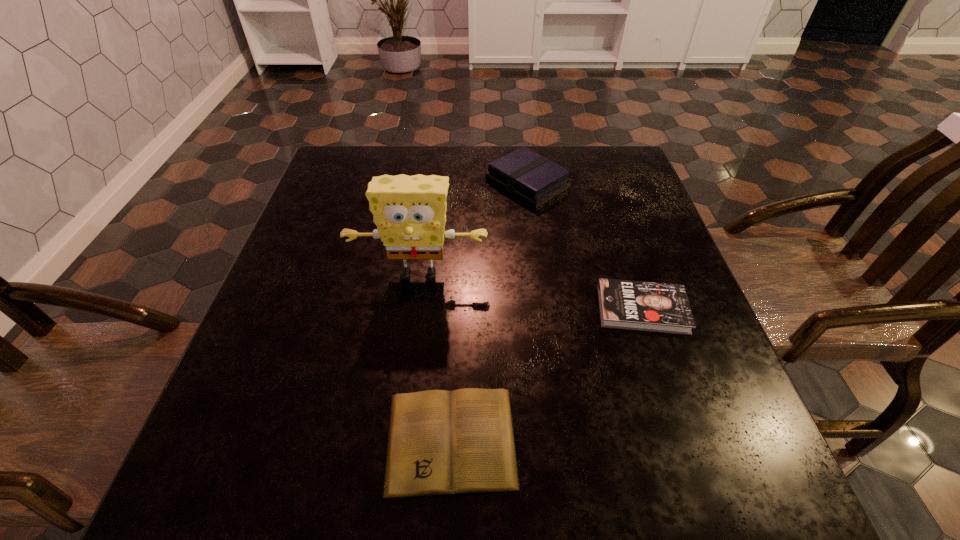
Where is `vacant area at the near right corner of the desktop`? The width and height of the screenshot is (960, 540). vacant area at the near right corner of the desktop is located at coordinates (787, 512).

Identify the location of empty location between the second tallest object and the nearest object. The width and height of the screenshot is (960, 540). (490, 312).

Where is `vacant region between the second shortest book and the tallest book`? The image size is (960, 540). vacant region between the second shortest book and the tallest book is located at coordinates (585, 246).

Identify the location of vacant point located between the nearest book and the tallest object. The width and height of the screenshot is (960, 540). (435, 357).

Locate an element on the screen. vacant space that's between the second shortest object and the tallest object is located at coordinates (531, 292).

You are a GUI agent. You are given a task and a screenshot of the screen. Output one action in this format:
    pyautogui.click(x=<x>, y=<y>)
    Task: Click on the free spot between the second nearest book and the shortest object
    
    Given the screenshot: What is the action you would take?
    pyautogui.click(x=546, y=375)

The height and width of the screenshot is (540, 960). What are the coordinates of `unoccupied position between the second shortest book and the sponge` in the screenshot? It's located at (531, 292).

In order to click on free area in between the nearest object and the second tallest book in this screenshot , I will do `click(546, 375)`.

The height and width of the screenshot is (540, 960). In order to click on free space between the tallest book and the nearest object in this screenshot , I will do `click(490, 312)`.

You are a GUI agent. You are given a task and a screenshot of the screen. Output one action in this format:
    pyautogui.click(x=<x>, y=<y>)
    Task: Click on the vacant area that lies between the farthest object and the nearest book
    Image resolution: width=960 pixels, height=540 pixels.
    Given the screenshot: What is the action you would take?
    pyautogui.click(x=490, y=312)